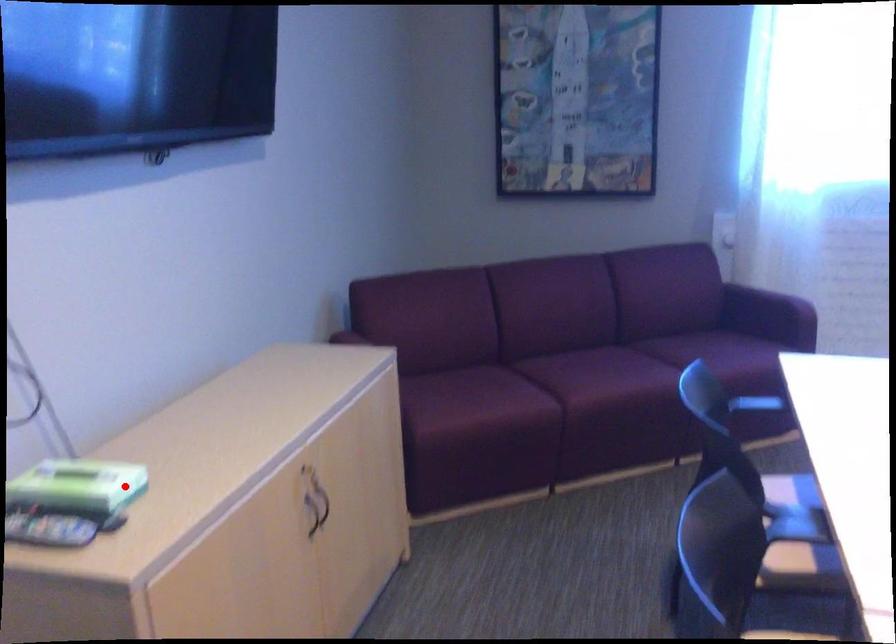
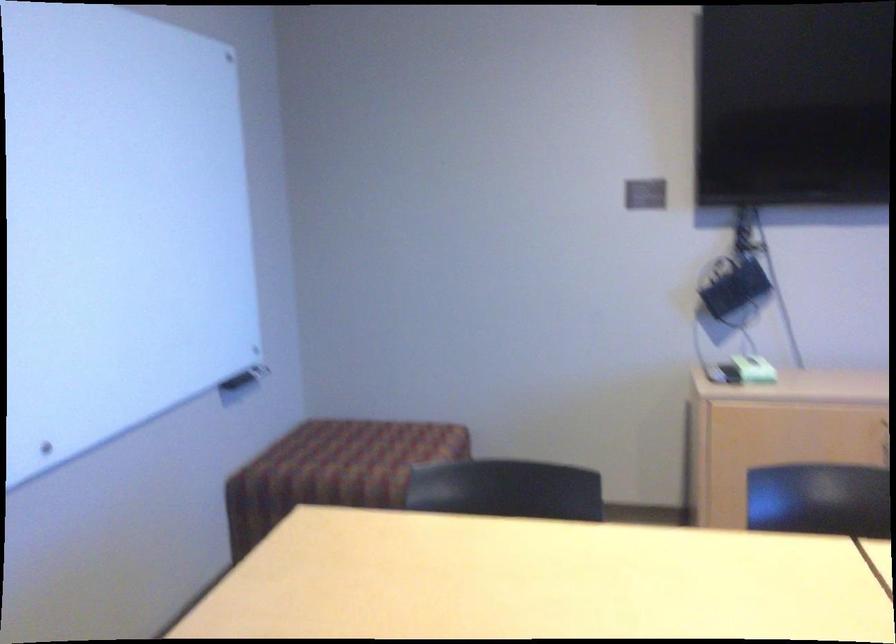
Question: I am providing you with two images of the same scene from different viewpoints. A red point is shown in image1. For the corresponding object point in image2, is it positioned nearer or farther from the camera?

Choices:
 (A) Nearer
 (B) Farther

Answer: (B)